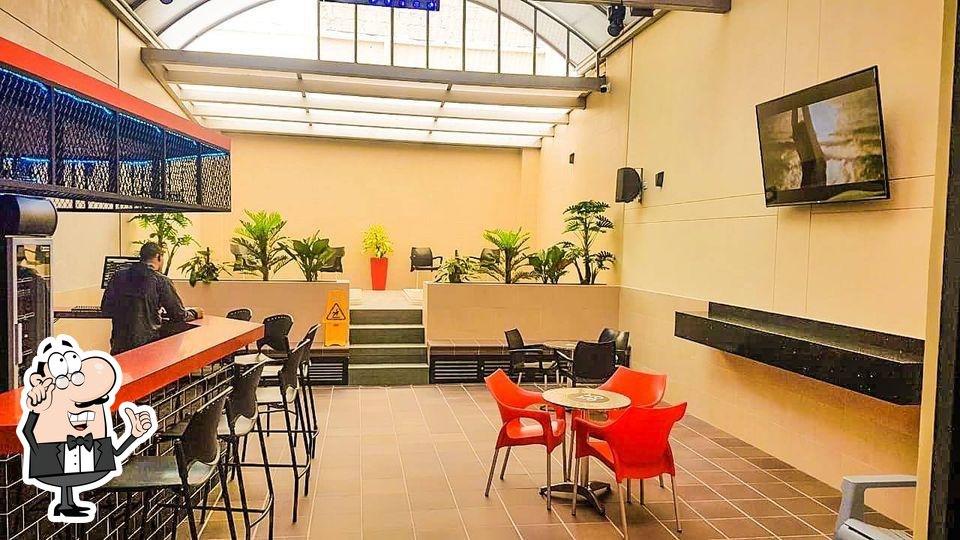
Find the location of a particular element. tall narrow red pot is located at coordinates (377, 272).